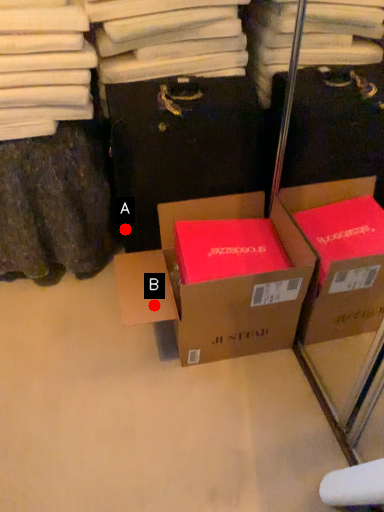
Question: Two points are circled on the image, labeled by A and B beside each circle. Which point is closer to the camera taking this photo?

Choices:
 (A) A is closer
 (B) B is closer

Answer: (B)